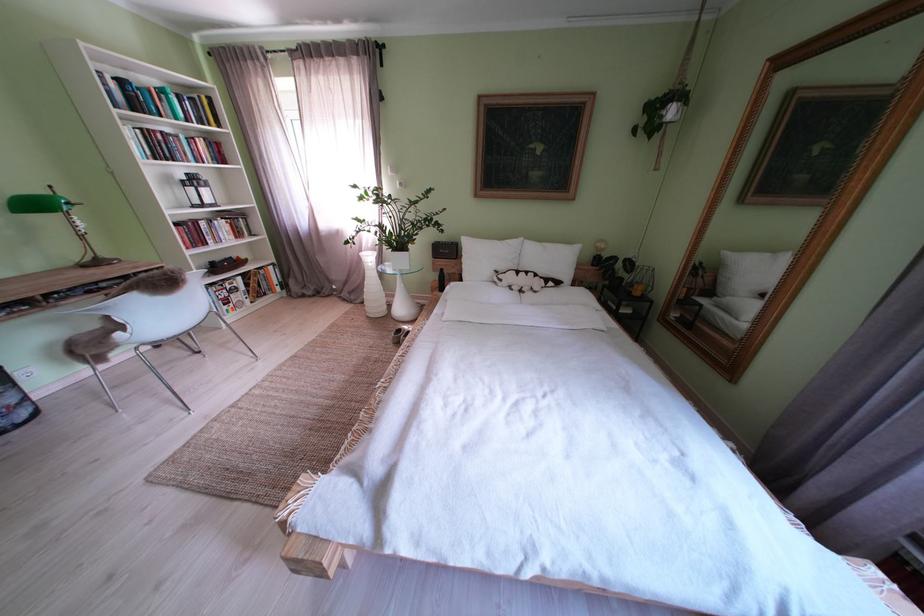
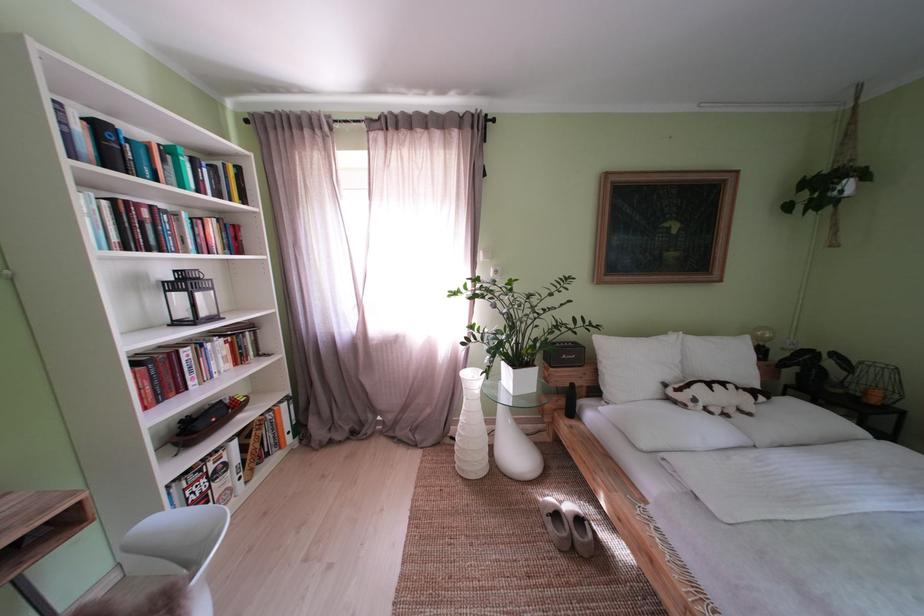
Which direction would the cameraman need to move to produce the second image?

The movement direction of the cameraman is left, forward.